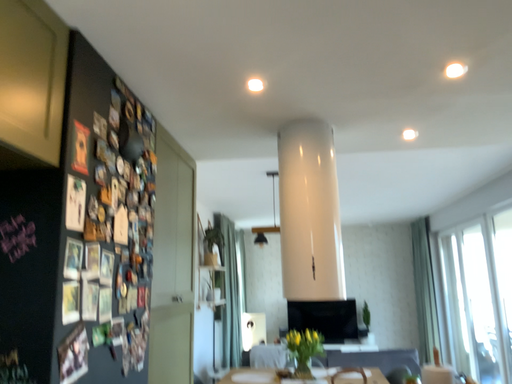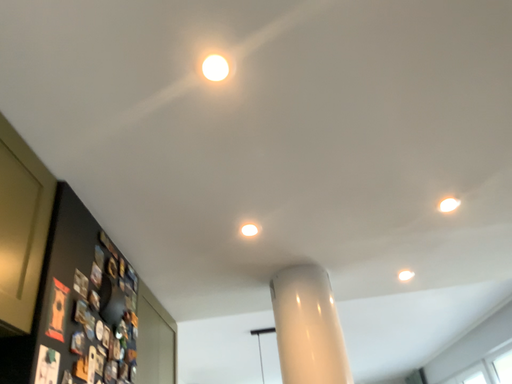
Question: How did the camera likely rotate when shooting the video?

Choices:
 (A) rotated upward
 (B) rotated downward

Answer: (A)